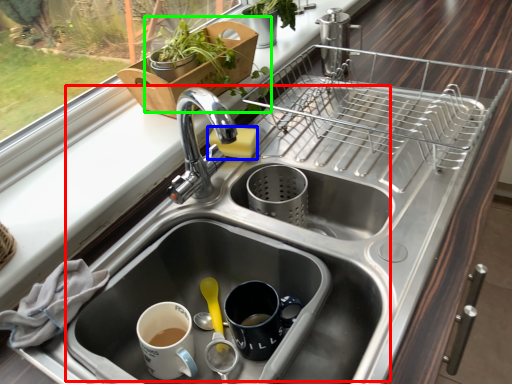
Question: Estimate the real-world distances between objects in this image. Which object is farther from sink (highlighted by a red box), soap (highlighted by a blue box) or houseplant (highlighted by a green box)?

Choices:
 (A) soap
 (B) houseplant

Answer: (B)